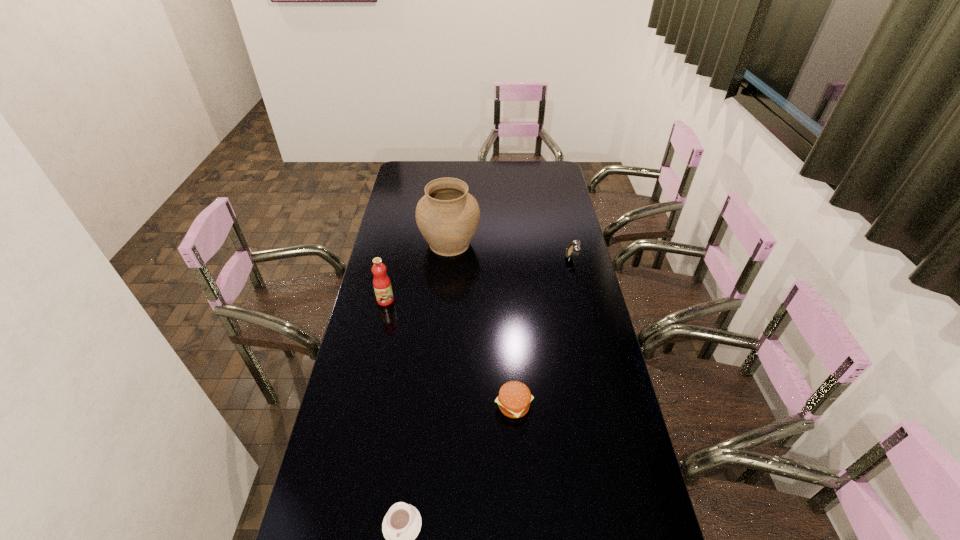
At what (x,y) coordinates should I click in order to perform the action: click on free spot located on the face of the rightmost object. Please return your answer as a coordinate pair (x, y). The height and width of the screenshot is (540, 960). Looking at the image, I should click on (501, 258).

Identify the location of blank area located 0.090m on the face of the rightmost object. (543, 258).

The height and width of the screenshot is (540, 960). In order to click on free space located on the left of the hamburger in this screenshot , I will do click(478, 406).

I want to click on object at the left edge, so click(x=382, y=286).

Where is `object that is at the right edge`? This screenshot has width=960, height=540. object that is at the right edge is located at coordinates (572, 251).

Identify the location of free space at the far edge of the desktop. The height and width of the screenshot is (540, 960). (487, 174).

Locate an element on the screen. This screenshot has width=960, height=540. vacant space at the left edge of the desktop is located at coordinates (374, 455).

This screenshot has height=540, width=960. In the image, there is a desktop. Find the location of `free space at the right edge`. free space at the right edge is located at coordinates (566, 326).

The image size is (960, 540). What are the coordinates of `free region at the far right corner of the desktop` in the screenshot? It's located at (548, 176).

Locate an element on the screen. vacant region between the rightmost object and the urn is located at coordinates (511, 251).